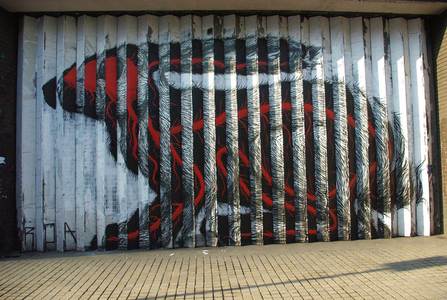
Where is `white ceiling`? The height and width of the screenshot is (300, 447). white ceiling is located at coordinates [250, 5].